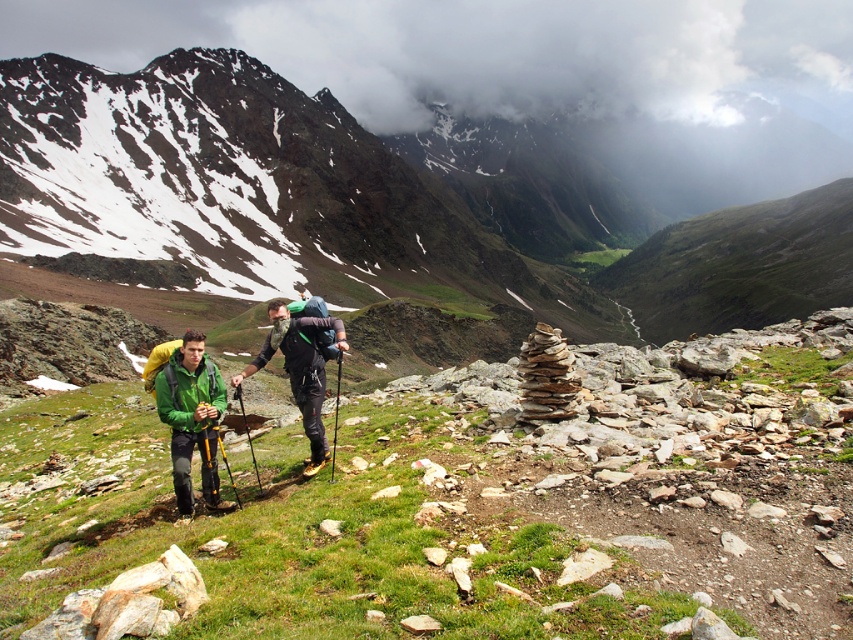
Question: Which of the following is the farthest from the observer?

Choices:
 (A) green matte jacket at center
 (B) green grassy mountain at center

Answer: (B)

Question: Which of the following is the farthest from the observer?

Choices:
 (A) (296, 352)
 (B) (155, 120)
 (C) (248, 365)
 (D) (221, 504)

Answer: (B)

Question: Is green grassy mountain at center behind matte green jacket at center?

Choices:
 (A) no
 (B) yes

Answer: (B)

Question: Is green matte jacket at center to the left of green matte jacket at lower left from the viewer's perspective?

Choices:
 (A) yes
 (B) no

Answer: (B)

Question: Is green grassy mountain at center thinner than matte green jacket at center?

Choices:
 (A) no
 (B) yes

Answer: (A)

Question: Which point is closer to the camera?

Choices:
 (A) (351, 220)
 (B) (321, 358)
 (C) (184, 451)
 (D) (312, 326)

Answer: (C)